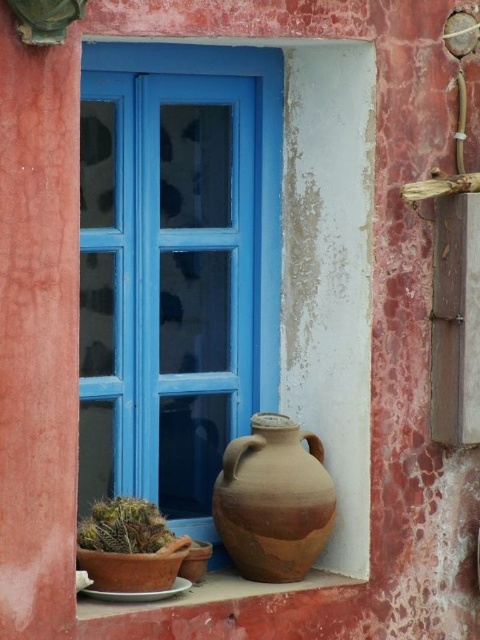
Question: Does terracotta pot at lower center appear on the left side of brown matte vase at lower center?

Choices:
 (A) yes
 (B) no

Answer: (A)

Question: Can you confirm if green matte cactus at lower left is positioned to the left of brown matte vase at lower center?

Choices:
 (A) no
 (B) yes

Answer: (B)

Question: Which point is farther to the camera?

Choices:
 (A) (131, 586)
 (B) (273, 429)
 (C) (264, 584)

Answer: (C)

Question: Estimate the real-world distances between objects in this image. Which object is farther from the brown matte vase at lower center?

Choices:
 (A) terracotta clay pot at lower left
 (B) brown clay pot at center
 (C) terracotta pot at lower center

Answer: (B)

Question: Does terracotta pot at lower center have a larger size compared to green matte cactus at lower left?

Choices:
 (A) yes
 (B) no

Answer: (A)

Question: Which of the following is the farthest from the observer?

Choices:
 (A) brown clay pot at center
 (B) terracotta clay pot at lower left
 (C) green matte cactus at lower left
 (D) brown matte vase at lower center

Answer: (A)